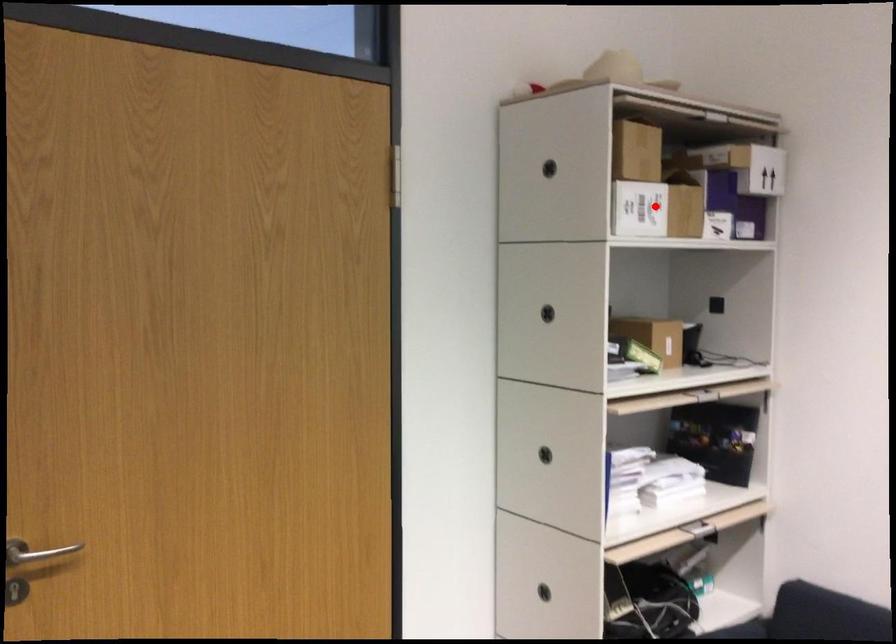
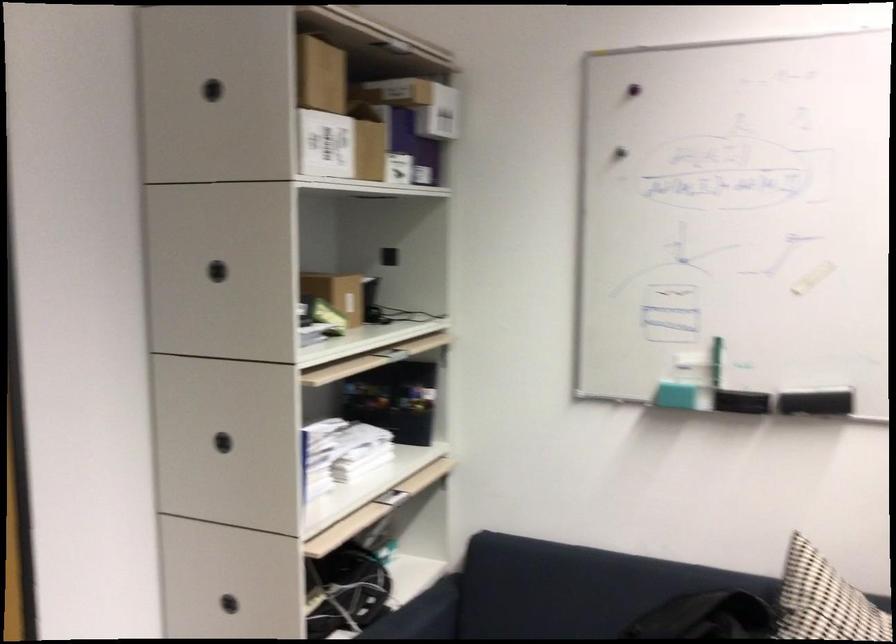
Locate, in the second image, the point that corresponds to the highlighted location in the first image.

(340, 146)